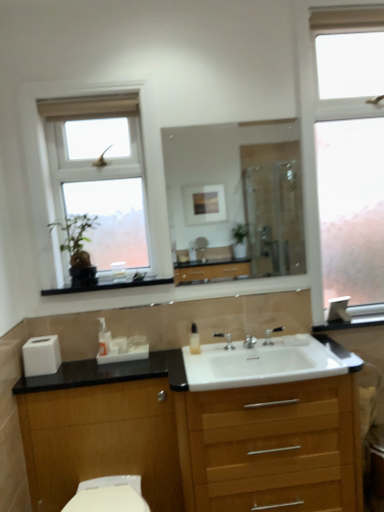
You are a GUI agent. You are given a task and a screenshot of the screen. Output one action in this format:
    pyautogui.click(x=<x>, y=<y>)
    Task: Click on the vacant area that is situated to the right of silver metallic tap at center, marked as the 1th tap in a left-to-right arrangement
    The width and height of the screenshot is (384, 512).
    Given the screenshot: What is the action you would take?
    pyautogui.click(x=245, y=347)